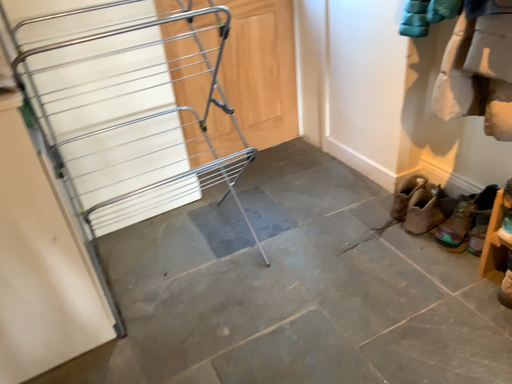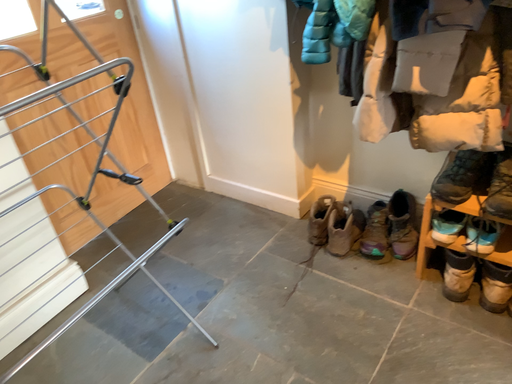
Question: How did the camera likely rotate when shooting the video?

Choices:
 (A) rotated right
 (B) rotated left

Answer: (A)